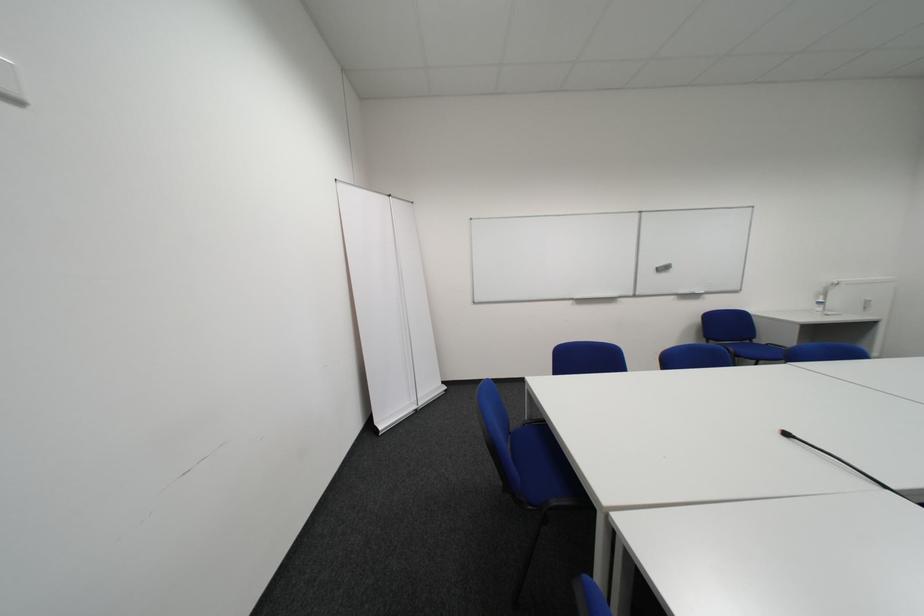
Describe the element at coordinates (842, 463) in the screenshot. The image size is (924, 616). I see `the black gooseneck microphone` at that location.